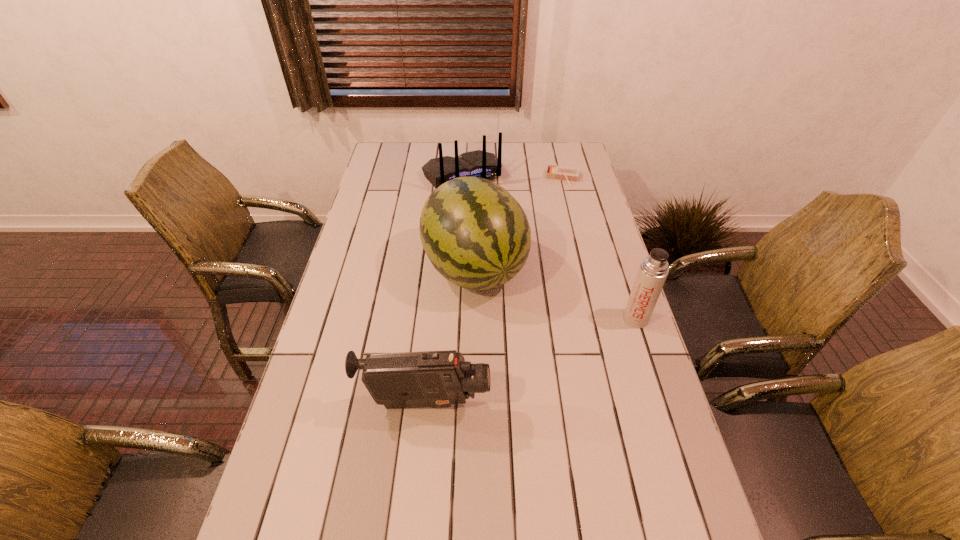
Find the location of `vacant space located 0.230m on the back of the router`. vacant space located 0.230m on the back of the router is located at coordinates (497, 228).

Find the location of a particular element. The height and width of the screenshot is (540, 960). vacant space located 0.220m on the back of the router is located at coordinates (496, 227).

This screenshot has height=540, width=960. I want to click on free region located 0.320m on the striking surface of the shortest object, so click(553, 238).

The width and height of the screenshot is (960, 540). I want to click on vacant space located on the striking surface of the shortest object, so click(x=557, y=212).

The image size is (960, 540). What are the coordinates of `vacant space positioned on the striking surface of the shortest object` in the screenshot? It's located at (557, 215).

The width and height of the screenshot is (960, 540). In order to click on vacant space located 0.130m at the stem end of the watermelon in this screenshot , I will do `click(521, 340)`.

In order to click on free space located 0.110m at the stem end of the watermelon in this screenshot , I will do (517, 335).

Locate an element on the screen. The image size is (960, 540). vacant space situated 0.170m at the stem end of the watermelon is located at coordinates (528, 350).

The width and height of the screenshot is (960, 540). Find the location of `router that is at the far edge`. router that is at the far edge is located at coordinates (x=479, y=163).

At what (x,y) coordinates should I click in order to perform the action: click on matchbox that is at the far edge. Please return your answer as a coordinate pair (x, y). Image resolution: width=960 pixels, height=540 pixels. Looking at the image, I should click on 568,174.